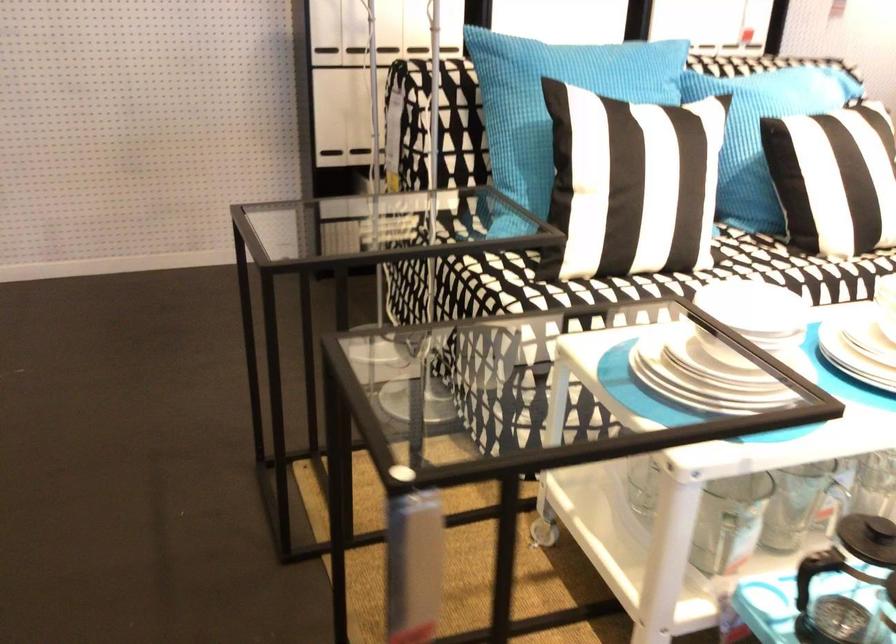
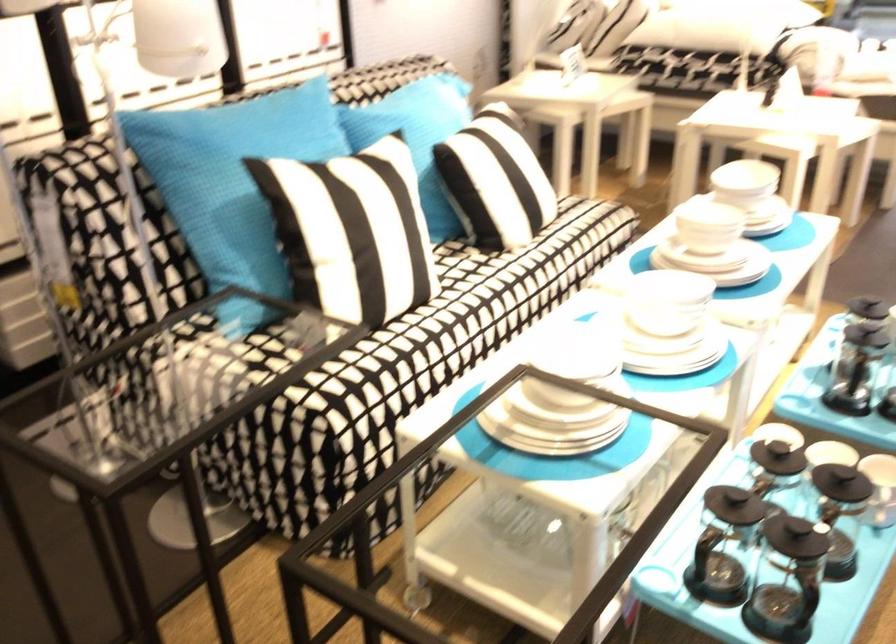
Question: The camera is either moving clockwise (left) or counter-clockwise (right) around the object. The first image is from the beginning of the video and the second image is from the end. Is the camera moving left or right when shooting the video?

Choices:
 (A) Left
 (B) Right

Answer: (A)